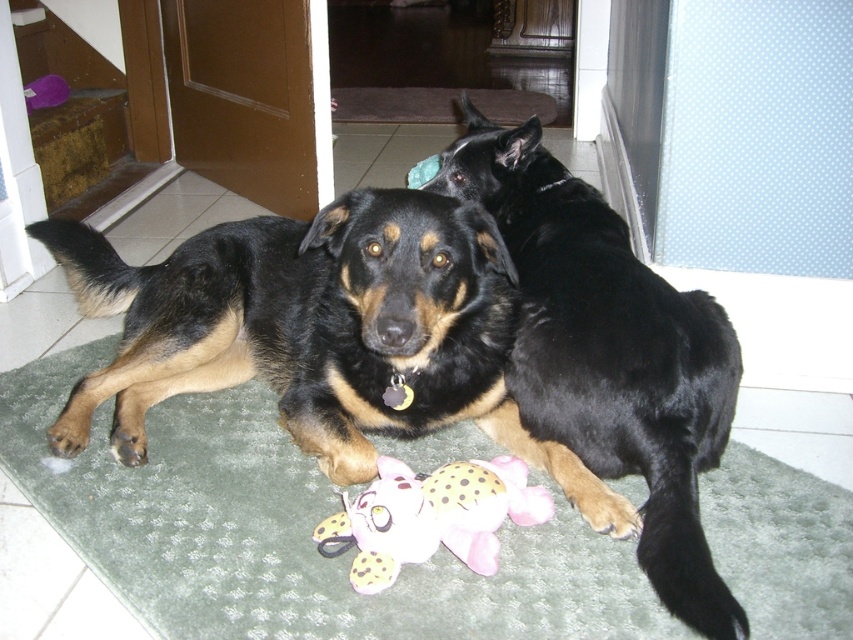
Question: Which of the following is the closest to the observer?

Choices:
 (A) black shiny fur dog at center
 (B) pink plush toy at center

Answer: (A)

Question: Which of the following is the closest to the observer?

Choices:
 (A) (514, 483)
 (B) (637, 596)
 (C) (219, 348)
 (D) (708, 316)

Answer: (B)

Question: Is black fur dog at center smaller than black shiny fur dog at center?

Choices:
 (A) yes
 (B) no

Answer: (B)

Question: Does black fur dog at center lie in front of black shiny fur dog at center?

Choices:
 (A) yes
 (B) no

Answer: (B)

Question: From the image, what is the correct spatial relationship of black shiny fur dog at center in relation to pink plush toy at center?

Choices:
 (A) right
 (B) left

Answer: (A)

Question: Which point appears farthest from the camera in this image?

Choices:
 (A) (672, 460)
 (B) (144, 364)

Answer: (B)